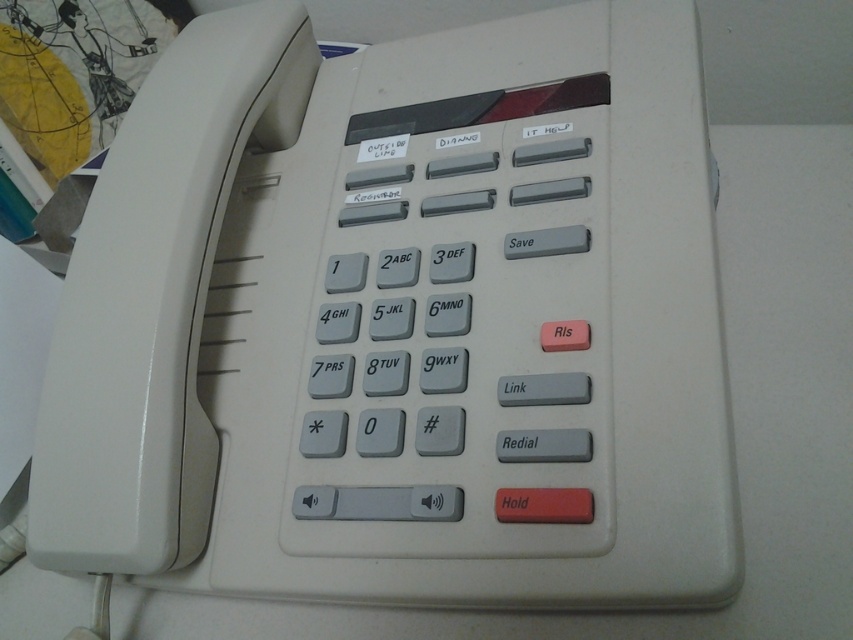
Question: Which point appears closest to the camera in this image?

Choices:
 (A) (496, 516)
 (B) (457, 266)

Answer: (A)

Question: Which point appears closest to the camera in this image?

Choices:
 (A) (459, 244)
 (B) (515, 513)

Answer: (B)

Question: Is matte red button at center bigger than matte gray key at center?

Choices:
 (A) yes
 (B) no

Answer: (A)

Question: Is matte red button at center in front of matte gray key at center?

Choices:
 (A) yes
 (B) no

Answer: (A)

Question: Does matte red button at center appear over matte gray key at center?

Choices:
 (A) yes
 (B) no

Answer: (B)